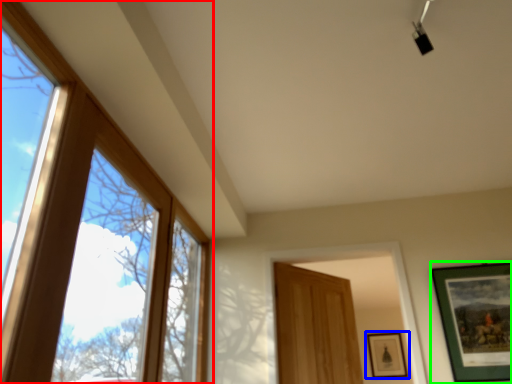
Question: Which object is the closest to the window (highlighted by a red box)? Choose among these: picture frame (highlighted by a blue box) or picture frame (highlighted by a green box).

Choices:
 (A) picture frame
 (B) picture frame

Answer: (B)